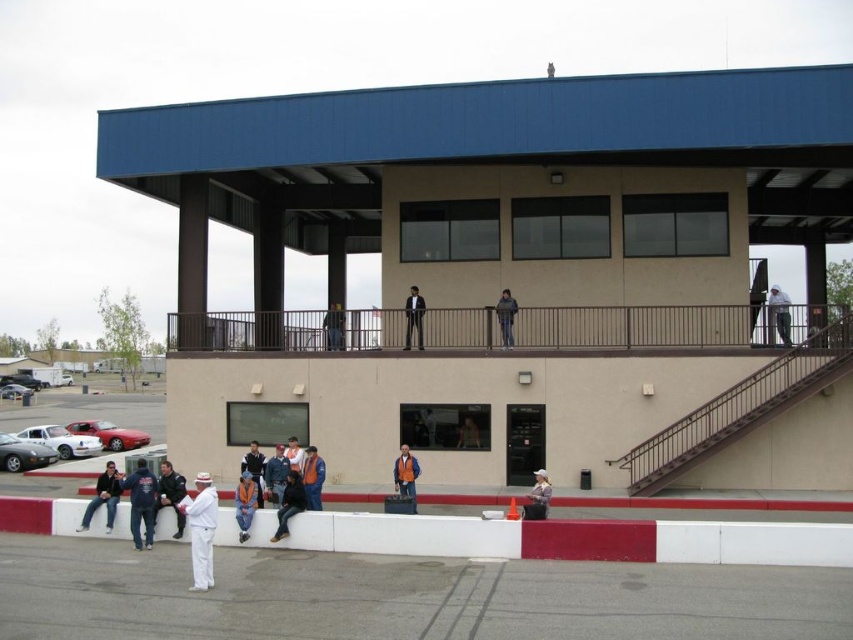
Question: Which point is farther from the camera taking this photo?

Choices:
 (A) (495, 310)
 (B) (115, 477)
 (C) (90, 401)
 (D) (283, 474)

Answer: (C)

Question: Is orange reflective vest at lower center behind orange safety vest at lower center?

Choices:
 (A) no
 (B) yes

Answer: (A)

Question: Is dark gray suit at upper center to the left of denim jacket at upper center from the viewer's perspective?

Choices:
 (A) no
 (B) yes

Answer: (B)

Question: Which point is farther to the camera?

Choices:
 (A) dark blue jacket at lower center
 (B) denim jacket at lower center
 (C) dark blue jacket at lower left
 (D) orange safety vest at center

Answer: (D)

Question: Where is dark blue jeans at upper center located in relation to white cotton shirt at lower center in the image?

Choices:
 (A) below
 (B) above

Answer: (B)

Question: Which point is closer to the camera?

Choices:
 (A) dark blue leather jacket at lower left
 (B) orange reflective vest at lower center

Answer: (B)